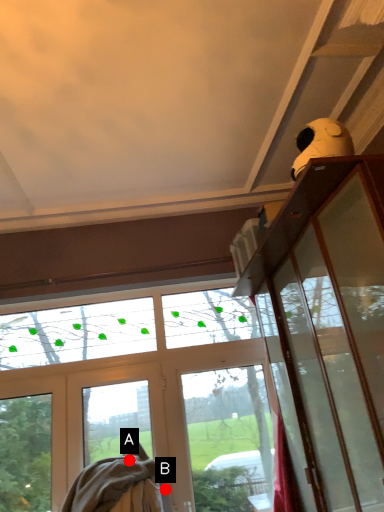
Question: Two points are circled on the image, labeled by A and B beside each circle. Which point appears farthest from the camera in this image?

Choices:
 (A) A is further
 (B) B is further

Answer: (B)